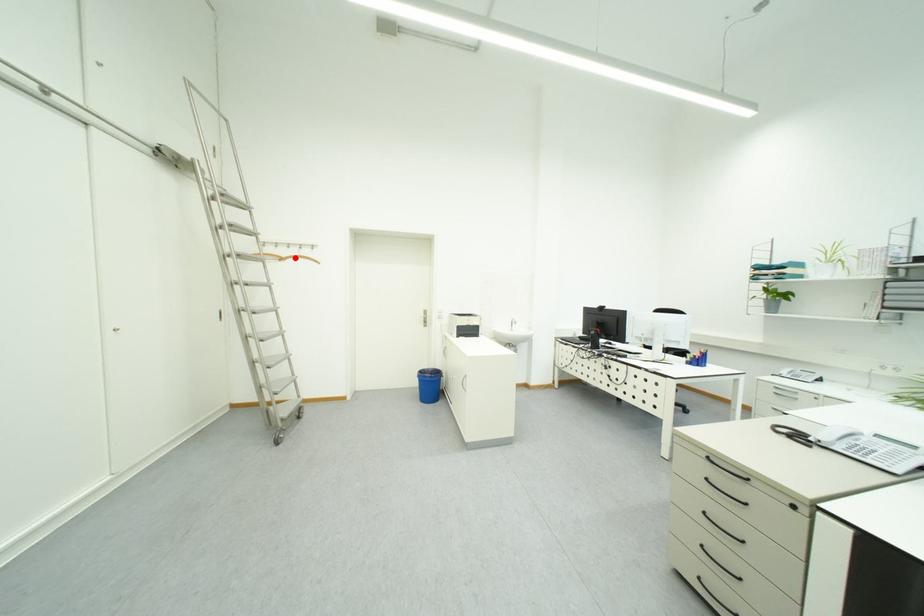
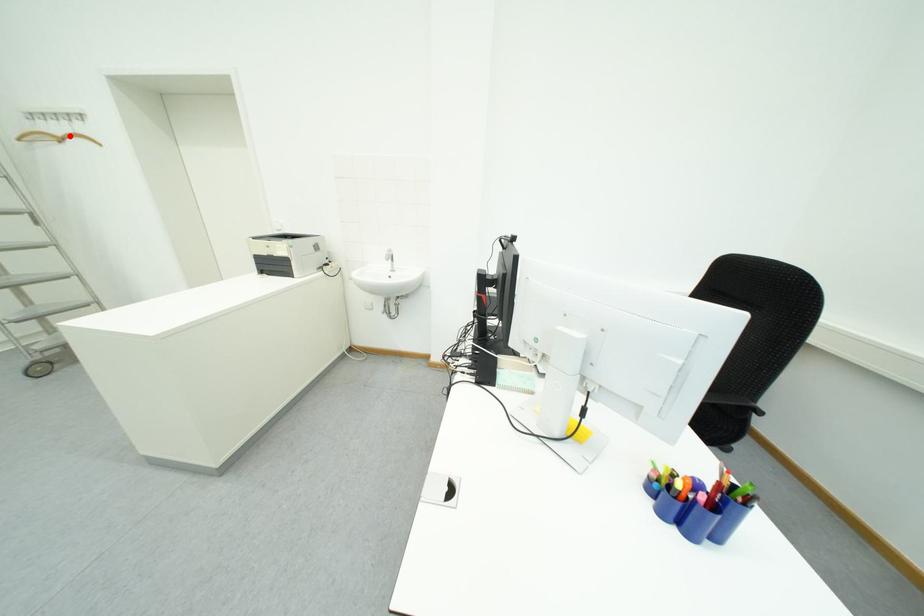
I am providing you with two images of the same scene from different viewpoints. A red point is marked on the first image and another point is marked on the second image. Do the highlighted points in image1 and image2 indicate the same real-world spot?

Yes